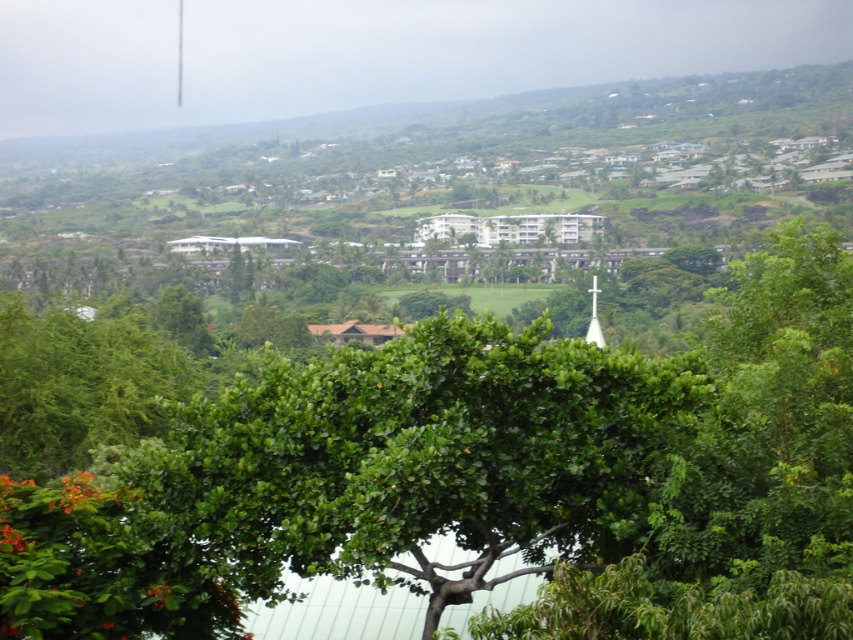
Is green leafy tree at center to the left of white glass spire at center from the viewer's perspective?

Indeed, green leafy tree at center is positioned on the left side of white glass spire at center.

Consider the image. Between green leafy tree at center and white glass spire at center, which one is positioned higher?

white glass spire at center is above.

Does point (424, 394) come in front of point (598, 292)?

Yes.

Where is `green leafy tree at center`? This screenshot has width=853, height=640. green leafy tree at center is located at coordinates (421, 460).